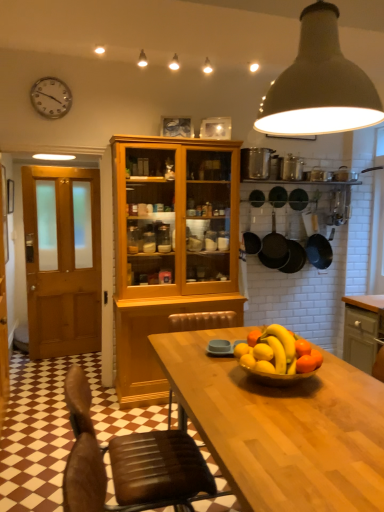
Question: In terms of height, does silver metallic clock at upper left look taller or shorter compared to white matte pendant light at upper center?

Choices:
 (A) short
 (B) tall

Answer: (A)

Question: Considering the relative positions of silver metallic clock at upper left and white matte pendant light at upper center in the image provided, is silver metallic clock at upper left to the left or to the right of white matte pendant light at upper center?

Choices:
 (A) left
 (B) right

Answer: (A)

Question: Based on their relative distances, which object is farther from the silver metallic clock at upper left?

Choices:
 (A) wooden door at left
 (B) brown leather chair at lower center
 (C) shiny golden bowl at center
 (D) white matte pendant light at upper center
 (E) matte gray cabinet at right

Answer: (E)

Question: Based on their relative distances, which object is farther from the shiny golden bowl at center?

Choices:
 (A) silver metallic clock at upper left
 (B) matte gray cabinet at right
 (C) white matte pendant light at upper center
 (D) brown leather chair at lower center
 (E) wooden door at left

Answer: (E)